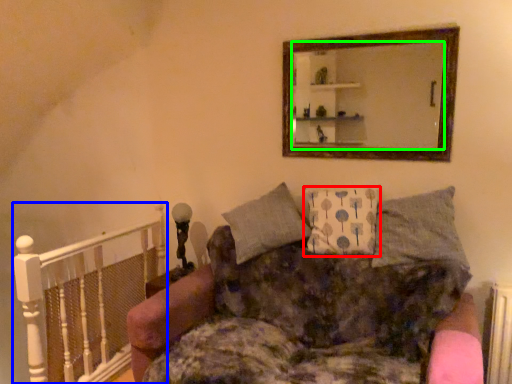
Question: Estimate the real-world distances between objects in this image. Which object is closer to pillow (highlighted by a red box), balustrade (highlighted by a blue box) or mirror (highlighted by a green box)?

Choices:
 (A) balustrade
 (B) mirror

Answer: (B)